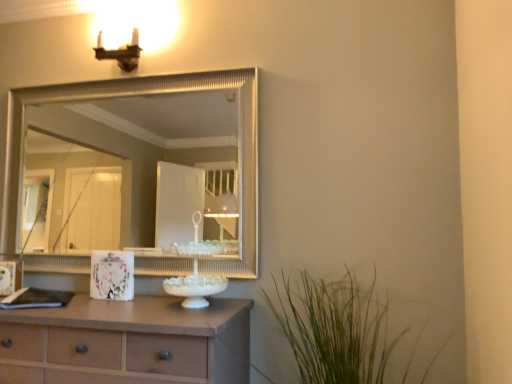
You are a GUI agent. You are given a task and a screenshot of the screen. Output one action in this format:
    pyautogui.click(x=<x>, y=<y>)
    Task: Click on the blank space situated above silver textured mirror at upper center (from a real-world perspective)
    The width and height of the screenshot is (512, 384).
    Given the screenshot: What is the action you would take?
    pyautogui.click(x=129, y=79)